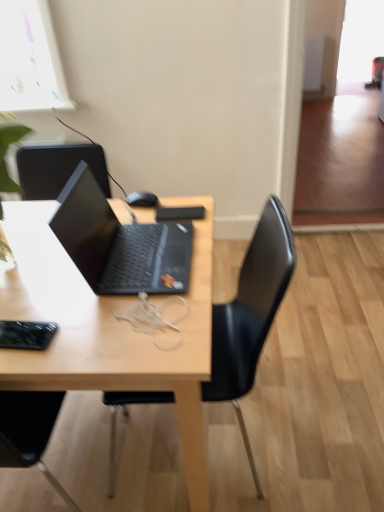
Question: Based on their positions, is black matte mouse at center located to the left or right of transparent glass window at upper right?

Choices:
 (A) right
 (B) left

Answer: (B)

Question: Is black matte mouse at center wider or thinner than transparent glass window at upper right?

Choices:
 (A) wide
 (B) thin

Answer: (A)

Question: Which object is the farthest from the transparent glass window at upper right?

Choices:
 (A) wooden desk at center
 (B) black matte mouse at center
 (C) black plastic chair at center
 (D) matte black laptop at center

Answer: (D)

Question: Considering the real-world distances, which object is closest to the wooden desk at center?

Choices:
 (A) black matte mouse at center
 (B) matte black laptop at center
 (C) black plastic chair at center
 (D) transparent glass window at upper right

Answer: (B)